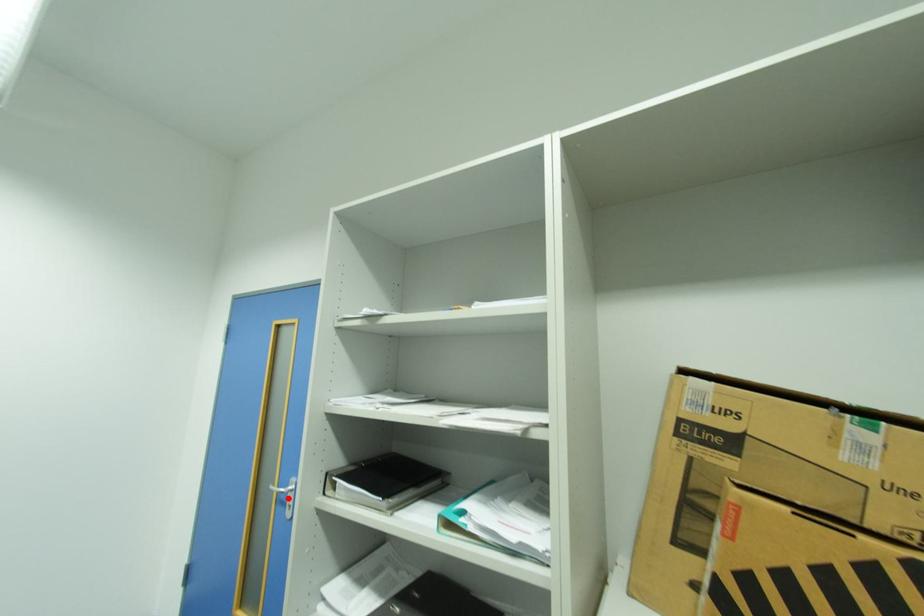
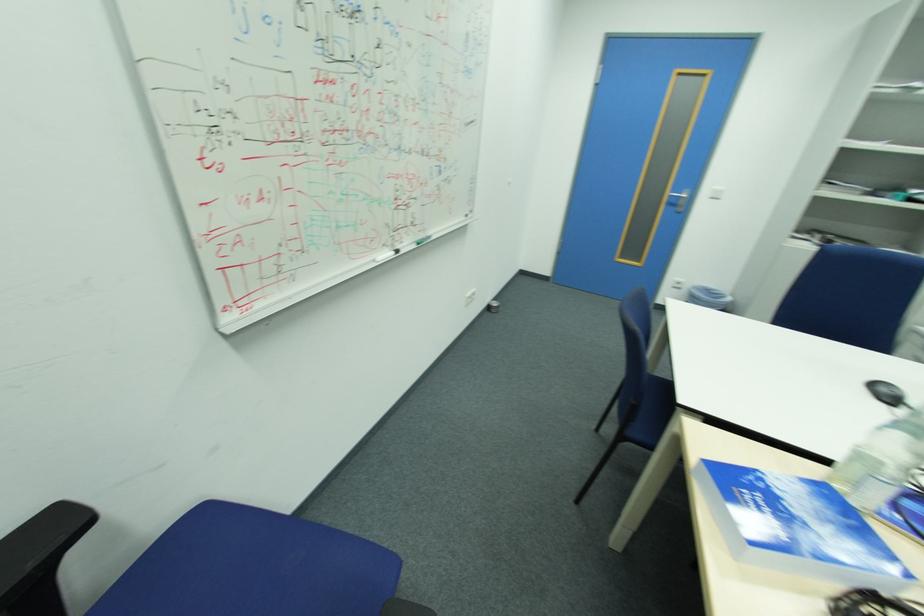
Find the pixel in the second image that matches the highlighted location in the first image.

(678, 203)